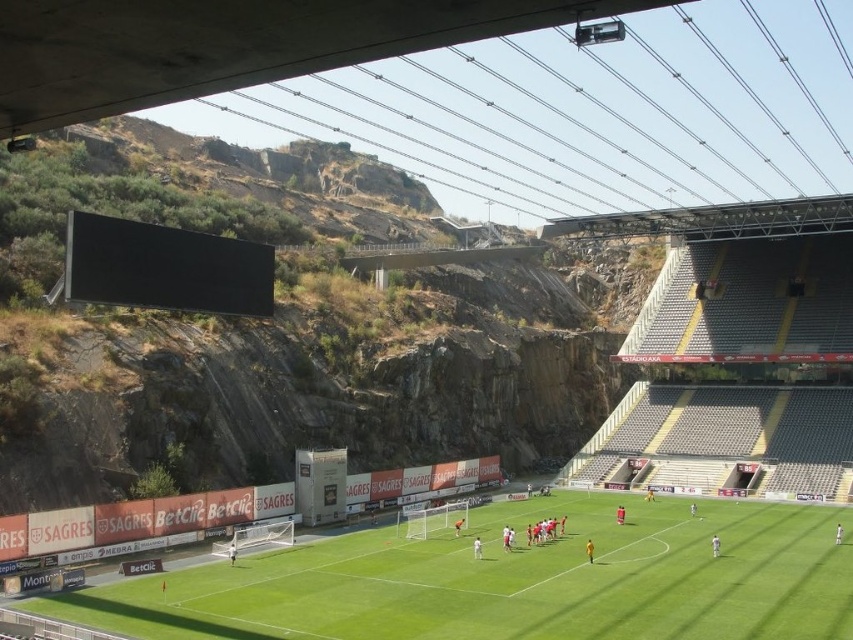
You are a soccer player standing on the field and see both the white matte soccer goal at lower center and the white matte soccer goal at center. Which one is positioned higher in the image?

The white matte soccer goal at lower center is positioned higher than the white matte soccer goal at center in the image.

You are a soccer player standing on the green grass football field at center. You want to kick the ball to the white matte soccer goal at center. In which direction should you kick the ball to score a goal?

The green grass football field at center is positioned on the right side of the white matte soccer goal at center, so you should kick the ball to the left to score a goal.